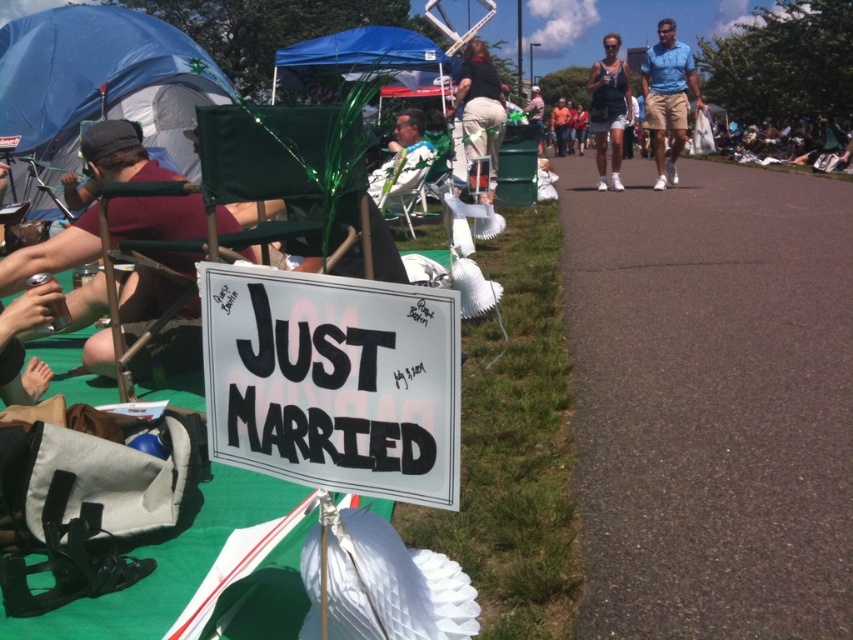
Based on the photo, which is above, blue cotton shirt at upper right or matte green chair at center?

blue cotton shirt at upper right is above.

Can you confirm if blue cotton shirt at upper right is bigger than matte green chair at center?

Yes.

Is point (676, 102) positioned after point (398, 115)?

No, it is in front of (398, 115).

At what (x,y) coordinates should I click in order to perform the action: click on blue cotton shirt at upper right. Please return your answer as a coordinate pair (x, y). The image size is (853, 640). Looking at the image, I should click on (666, 97).

Between point (412, 36) and point (595, 67), which one is positioned behind?

Point (595, 67)

Which is more to the left, blue fabric canopy at upper center or denim shorts at center?

Positioned to the left is blue fabric canopy at upper center.

Which is in front, point (416, 52) or point (585, 86)?

Point (416, 52) is more forward.

Identify the location of blue fabric canopy at upper center. (369, 58).

Which of these two, blue fabric canopy at upper left or white cotton shirt at center, stands taller?

blue fabric canopy at upper left

Does point (204, 88) come in front of point (579, 148)?

Yes, it is.

I want to click on blue fabric canopy at upper left, so click(x=102, y=80).